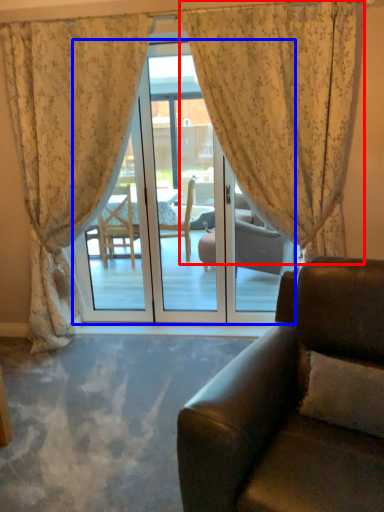
Question: Which object appears closest to the camera in this image, curtain (highlighted by a red box) or door (highlighted by a blue box)?

Choices:
 (A) curtain
 (B) door

Answer: (A)